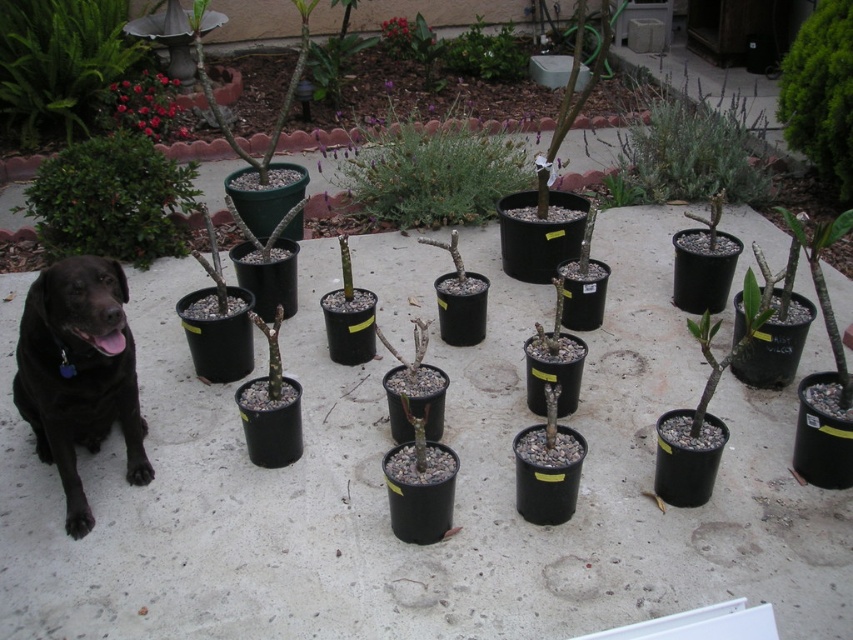
From the picture: You are a gardener who wants to water the green matte plant at upper left and the pink matte flowers at upper left. Since both are in the upper left area, can you tell me which one is positioned higher?

The green matte plant at upper left is located above the pink matte flowers at upper left, so it is positioned higher.

You are standing at the point marked by the coordinate point (486, 54) in the image. What object is located at that point?

The point (486, 54) marks the green matte plant at upper center.